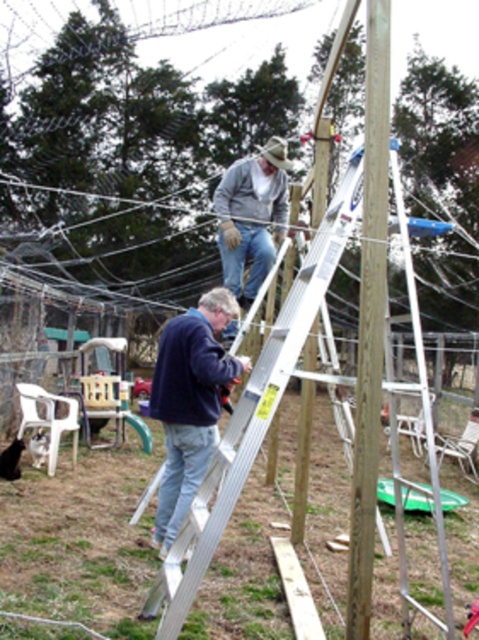
Is silver metallic ladder at upper center above gray woolen sweater at upper center?

Incorrect, silver metallic ladder at upper center is not positioned above gray woolen sweater at upper center.

Is point (262, 362) less distant than point (263, 262)?

Yes.

This screenshot has width=479, height=640. What do you see at coordinates (253, 412) in the screenshot?
I see `silver metallic ladder at upper center` at bounding box center [253, 412].

You are a GUI agent. You are given a task and a screenshot of the screen. Output one action in this format:
    pyautogui.click(x=<x>, y=<y>)
    Task: Click on the silver metallic ladder at upper center
    The image size is (479, 640).
    Given the screenshot: What is the action you would take?
    pyautogui.click(x=253, y=412)

Who is lower down, silver metallic ladder at upper center or navy blue sweater at center?

Positioned lower is navy blue sweater at center.

Between point (231, 484) and point (171, 509), which one is positioned behind?

Positioned behind is point (171, 509).

Which is in front, point (227, 477) or point (213, 406)?

Point (227, 477) is in front.

This screenshot has height=640, width=479. Find the location of `silver metallic ladder at upper center`. silver metallic ladder at upper center is located at coordinates (253, 412).

From the picture: Is brown wood telegraph pole at center positioned in front of navy blue sweater at center?

Yes, it is in front of navy blue sweater at center.

The image size is (479, 640). What do you see at coordinates (369, 321) in the screenshot? I see `brown wood telegraph pole at center` at bounding box center [369, 321].

Which is behind, point (378, 330) or point (168, 531)?

Point (168, 531)

I want to click on brown wood telegraph pole at center, so [369, 321].